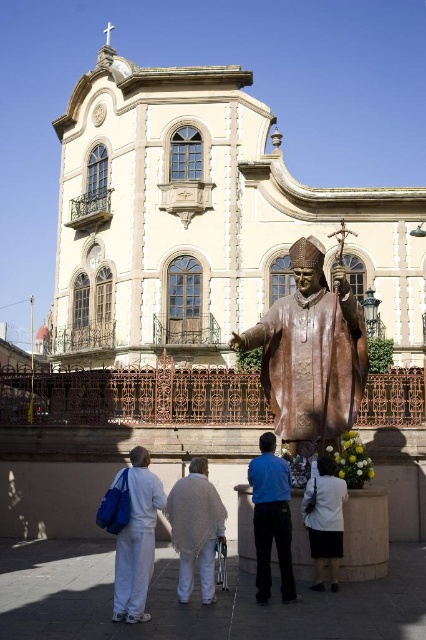
Based on the photo, you are standing in front of the statue and want to take a photo of the white cotton pants at lower left and the white fabric at lower center. Which one is closer to the ground?

The white cotton pants at lower left is below white fabric at lower center, so it is closer to the ground.

You are a photographer trying to capture the statue of the bishop. You notice two people in the foreground wearing the blue fabric shirt at center and the white fabric at lower center. Which person is shorter in height?

The blue fabric shirt at center is shorter in height compared to the white fabric at lower center.

You are a photographer trying to capture the statue of the bishop without any people in the frame. You notice the blue fabric shirt at center and the white fabric at lower center. Which of these two items is narrower and might be easier to avoid blocking the statue?

The blue fabric shirt at center is thinner than the white fabric at lower center, so it is narrower and might be easier to avoid blocking the statue.